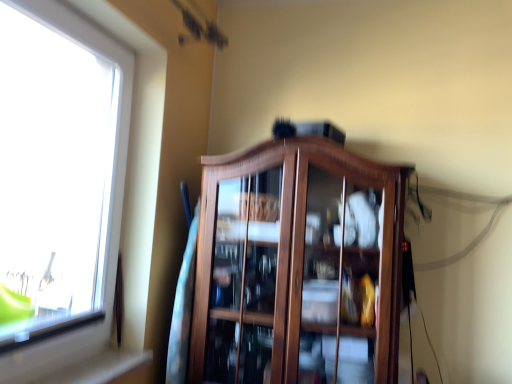
Question: Would you say transparent glass window at left contains wooden cabinet at center?

Choices:
 (A) no
 (B) yes

Answer: (A)

Question: From a real-world perspective, is transparent glass window at left physically below wooden cabinet at center?

Choices:
 (A) yes
 (B) no

Answer: (B)

Question: Is transparent glass window at left further to camera compared to wooden cabinet at center?

Choices:
 (A) no
 (B) yes

Answer: (A)

Question: From the image's perspective, is transparent glass window at left above wooden cabinet at center?

Choices:
 (A) yes
 (B) no

Answer: (A)

Question: Is transparent glass window at left at the right side of wooden cabinet at center?

Choices:
 (A) no
 (B) yes

Answer: (A)

Question: Can you confirm if transparent glass window at left is shorter than wooden cabinet at center?

Choices:
 (A) yes
 (B) no

Answer: (B)

Question: Are wooden cabinet at center and transparent glass window at left located far from each other?

Choices:
 (A) no
 (B) yes

Answer: (A)

Question: Can you confirm if wooden cabinet at center is thinner than transparent glass window at left?

Choices:
 (A) yes
 (B) no

Answer: (B)

Question: Is wooden cabinet at center shorter than transparent glass window at left?

Choices:
 (A) yes
 (B) no

Answer: (A)

Question: Would you say wooden cabinet at center contains transparent glass window at left?

Choices:
 (A) no
 (B) yes

Answer: (A)

Question: From the image's perspective, is wooden cabinet at center on top of transparent glass window at left?

Choices:
 (A) no
 (B) yes

Answer: (A)

Question: Is wooden cabinet at center at the right side of transparent glass window at left?

Choices:
 (A) yes
 (B) no

Answer: (A)

Question: From a real-world perspective, relative to transparent glass window at left, is wooden cabinet at center vertically above or below?

Choices:
 (A) below
 (B) above

Answer: (A)